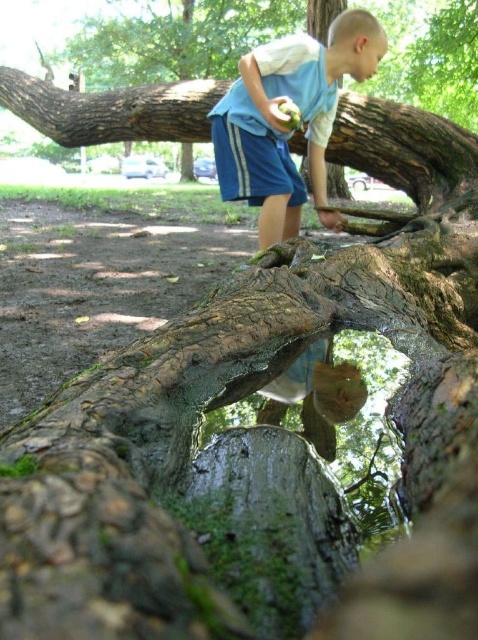
Is blue cotton shorts at center wider than rough bark tree trunk at upper center?

Incorrect, blue cotton shorts at center's width does not surpass rough bark tree trunk at upper center's.

Is blue cotton shorts at center to the left of rough bark tree trunk at upper center from the viewer's perspective?

Incorrect, blue cotton shorts at center is not on the left side of rough bark tree trunk at upper center.

The image size is (478, 640). Identify the location of blue cotton shorts at center. (282, 118).